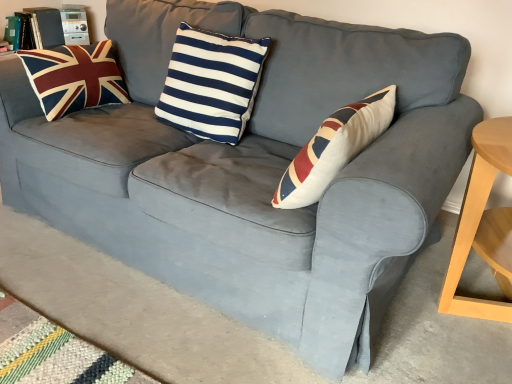
Image resolution: width=512 pixels, height=384 pixels. What do you see at coordinates (74, 78) in the screenshot?
I see `velvet union jack pillow at left, which is the second pillow in right-to-left order` at bounding box center [74, 78].

In order to click on velvet union jack pillow at left, the first pillow from the left in this screenshot , I will do `click(74, 78)`.

Locate an element on the screen. The image size is (512, 384). navy/white striped cushion at center, the first pillow from the right is located at coordinates (211, 83).

Measure the distance between navy/white striped cushion at center, the first pillow from the right, and camera.

The distance of navy/white striped cushion at center, the first pillow from the right, from camera is 4.79 feet.

Measure the distance between point [194,80] and camera.

Point [194,80] and camera are 5.02 feet apart.

The height and width of the screenshot is (384, 512). What do you see at coordinates (211, 83) in the screenshot?
I see `navy/white striped cushion at center, the first pillow from the right` at bounding box center [211, 83].

The height and width of the screenshot is (384, 512). I want to click on velvet union jack pillow at left, which is the second pillow in right-to-left order, so click(x=74, y=78).

Does navy/white striped cushion at center, the first pillow from the right, appear on the right side of velvet union jack pillow at left, the first pillow from the left?

Yes.

In the image, is navy/white striped cushion at center, positioned as the 2th pillow in left-to-right order, positioned in front of or behind velvet union jack pillow at left, the first pillow from the left?

Clearly, navy/white striped cushion at center, positioned as the 2th pillow in left-to-right order, is in front of velvet union jack pillow at left, the first pillow from the left.

Which point is more distant from viewer, (198, 39) or (127, 101)?

The point (127, 101) is more distant.

From the image's perspective, would you say navy/white striped cushion at center, positioned as the 2th pillow in left-to-right order, is positioned over velvet union jack pillow at left, the first pillow from the left?

No.

From a real-world perspective, is navy/white striped cushion at center, the first pillow from the right, located higher than velvet union jack pillow at left, the first pillow from the left?

Yes, from a real-world perspective, navy/white striped cushion at center, the first pillow from the right, is over velvet union jack pillow at left, the first pillow from the left

Which object is wider, navy/white striped cushion at center, the first pillow from the right, or velvet union jack pillow at left, which is the second pillow in right-to-left order?

With larger width is velvet union jack pillow at left, which is the second pillow in right-to-left order.

Which of these two, navy/white striped cushion at center, the first pillow from the right, or velvet union jack pillow at left, which is the second pillow in right-to-left order, stands taller?

With more height is navy/white striped cushion at center, the first pillow from the right.

Can you confirm if navy/white striped cushion at center, positioned as the 2th pillow in left-to-right order, is smaller than velvet union jack pillow at left, the first pillow from the left?

No.

Can velvet union jack pillow at left, the first pillow from the left, be found inside navy/white striped cushion at center, the first pillow from the right?

No, velvet union jack pillow at left, the first pillow from the left, is not surrounded by navy/white striped cushion at center, the first pillow from the right.

Is navy/white striped cushion at center, the first pillow from the right, in contact with velvet union jack pillow at left, which is the second pillow in right-to-left order?

navy/white striped cushion at center, the first pillow from the right, is not next to velvet union jack pillow at left, which is the second pillow in right-to-left order, and they're not touching.

Is navy/white striped cushion at center, positioned as the 2th pillow in left-to-right order, oriented away from velvet union jack pillow at left, the first pillow from the left?

No, navy/white striped cushion at center, positioned as the 2th pillow in left-to-right order, is not facing away from velvet union jack pillow at left, the first pillow from the left.

The width and height of the screenshot is (512, 384). I want to click on pillow lying below the velvet union jack pillow at left, the first pillow from the left (from the image's perspective), so (x=211, y=83).

Considering the positions of objects velvet union jack pillow at left, which is the second pillow in right-to-left order, and navy/white striped cushion at center, positioned as the 2th pillow in left-to-right order, in the image provided, who is more to the left, velvet union jack pillow at left, which is the second pillow in right-to-left order, or navy/white striped cushion at center, positioned as the 2th pillow in left-to-right order,?

velvet union jack pillow at left, which is the second pillow in right-to-left order.

Does velvet union jack pillow at left, the first pillow from the left, come behind navy/white striped cushion at center, positioned as the 2th pillow in left-to-right order?

Yes.

Which is in front, point (86, 46) or point (212, 56)?

Positioned in front is point (212, 56).

From the image's perspective, is velvet union jack pillow at left, the first pillow from the left, above or below navy/white striped cushion at center, positioned as the 2th pillow in left-to-right order?

velvet union jack pillow at left, the first pillow from the left, is situated higher than navy/white striped cushion at center, positioned as the 2th pillow in left-to-right order, in the image.

From a real-world perspective, is velvet union jack pillow at left, which is the second pillow in right-to-left order, on top of navy/white striped cushion at center, positioned as the 2th pillow in left-to-right order?

No, from a real-world perspective, velvet union jack pillow at left, which is the second pillow in right-to-left order, is not on top of navy/white striped cushion at center, positioned as the 2th pillow in left-to-right order.

Is velvet union jack pillow at left, the first pillow from the left, wider or thinner than navy/white striped cushion at center, positioned as the 2th pillow in left-to-right order?

velvet union jack pillow at left, the first pillow from the left, is wider than navy/white striped cushion at center, positioned as the 2th pillow in left-to-right order.

In terms of height, does velvet union jack pillow at left, the first pillow from the left, look taller or shorter compared to navy/white striped cushion at center, positioned as the 2th pillow in left-to-right order?

Considering their sizes, velvet union jack pillow at left, the first pillow from the left, has less height than navy/white striped cushion at center, positioned as the 2th pillow in left-to-right order.

Considering the sizes of objects velvet union jack pillow at left, which is the second pillow in right-to-left order, and navy/white striped cushion at center, the first pillow from the right, in the image provided, who is smaller, velvet union jack pillow at left, which is the second pillow in right-to-left order, or navy/white striped cushion at center, the first pillow from the right,?

With smaller size is velvet union jack pillow at left, which is the second pillow in right-to-left order.

Can we say velvet union jack pillow at left, which is the second pillow in right-to-left order, lies outside navy/white striped cushion at center, the first pillow from the right?

velvet union jack pillow at left, which is the second pillow in right-to-left order, is positioned outside navy/white striped cushion at center, the first pillow from the right.

Looking at this image, would you consider velvet union jack pillow at left, the first pillow from the left, to be distant from navy/white striped cushion at center, positioned as the 2th pillow in left-to-right order?

velvet union jack pillow at left, the first pillow from the left, is near navy/white striped cushion at center, positioned as the 2th pillow in left-to-right order, not far away.

Is navy/white striped cushion at center, the first pillow from the right, at the back of velvet union jack pillow at left, which is the second pillow in right-to-left order?

No, velvet union jack pillow at left, which is the second pillow in right-to-left order,'s orientation is not away from navy/white striped cushion at center, the first pillow from the right.

At what (x,y) coordinates should I click in order to perform the action: click on pillow to the left of navy/white striped cushion at center, the first pillow from the right. Please return your answer as a coordinate pair (x, y). This screenshot has height=384, width=512. Looking at the image, I should click on (74, 78).

This screenshot has height=384, width=512. Identify the location of pillow above the velvet union jack pillow at left, which is the second pillow in right-to-left order (from a real-world perspective). (211, 83).

Find the location of a particular element. Image resolution: width=512 pixels, height=384 pixels. pillow on the left of the navy/white striped cushion at center, positioned as the 2th pillow in left-to-right order is located at coordinates [x=74, y=78].